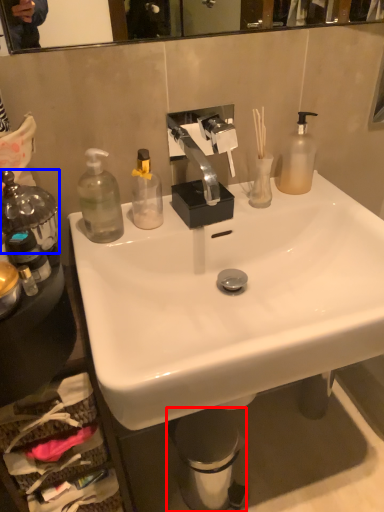
Question: Which of the following is the closest to the observer, trash bin/can (highlighted by a red box) or bottle (highlighted by a blue box)?

Choices:
 (A) trash bin/can
 (B) bottle

Answer: (B)